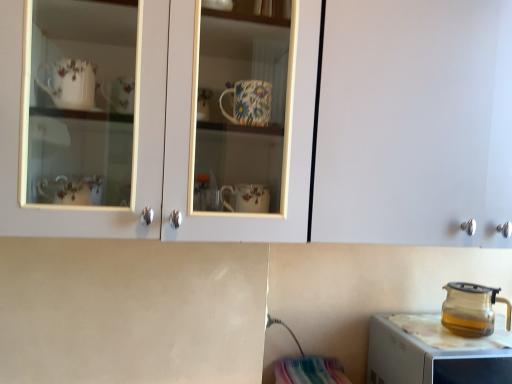
Image resolution: width=512 pixels, height=384 pixels. What do you see at coordinates (415, 122) in the screenshot? I see `matte white cabinet at upper center` at bounding box center [415, 122].

What is the approximate height of transparent glass kettle at lower right?

transparent glass kettle at lower right is 25.45 centimeters in height.

Locate an element on the screen. This screenshot has height=384, width=512. transparent glass kettle at lower right is located at coordinates (430, 354).

What are the coordinates of `matte white cabinet at upper center` in the screenshot? It's located at (415, 122).

Is matte white cabinet at upper center facing towards transparent glass teapot at right?

No, matte white cabinet at upper center is not facing towards transparent glass teapot at right.

Considering the relative sizes of matte white cabinet at upper center and transparent glass teapot at right in the image provided, is matte white cabinet at upper center taller than transparent glass teapot at right?

Indeed, matte white cabinet at upper center has a greater height compared to transparent glass teapot at right.

Is matte white cabinet at upper center beside transparent glass teapot at right?

No, matte white cabinet at upper center is not with transparent glass teapot at right.

Between point (396, 88) and point (415, 327), which one is positioned in front?

The point (396, 88) is closer to the camera.

Could transparent glass kettle at lower right be considered to be inside matte white cabinet at upper center?

No, transparent glass kettle at lower right is not a part of matte white cabinet at upper center.

Is matte white cabinet at upper center facing towards transparent glass kettle at lower right?

No, matte white cabinet at upper center is not turned towards transparent glass kettle at lower right.

Locate an element on the screen. The width and height of the screenshot is (512, 384). home appliance in front of the transparent glass teapot at right is located at coordinates (430, 354).

Would you say transparent glass kettle at lower right is part of transparent glass teapot at right's contents?

That's incorrect, transparent glass kettle at lower right is not inside transparent glass teapot at right.

Is point (493, 300) farther from viewer compared to point (448, 346)?

Yes.

Considering the sizes of transparent glass teapot at right and transparent glass kettle at lower right in the image, is transparent glass teapot at right taller or shorter than transparent glass kettle at lower right?

Clearly, transparent glass teapot at right is shorter compared to transparent glass kettle at lower right.

The image size is (512, 384). In order to click on cabinetry located on the left of transparent glass teapot at right in this screenshot , I will do `click(415, 122)`.

Can matte white cabinet at upper center be found inside transparent glass teapot at right?

Actually, matte white cabinet at upper center is outside transparent glass teapot at right.

From a real-world perspective, is transparent glass teapot at right above or below matte white cabinet at upper center?

From a real-world perspective, transparent glass teapot at right is physically below matte white cabinet at upper center.

Which is more distant, (475,306) or (445,122)?

Positioned behind is point (475,306).

Are transparent glass kettle at lower right and matte white cabinet at upper center located far from each other?

That's not correct — transparent glass kettle at lower right is a little close to matte white cabinet at upper center.

How many degrees apart are the facing directions of transparent glass kettle at lower right and matte white cabinet at upper center?

They differ by 2 degrees in their facing directions.

Does transparent glass kettle at lower right turn towards matte white cabinet at upper center?

No, transparent glass kettle at lower right is not oriented towards matte white cabinet at upper center.

From a real-world perspective, is transparent glass kettle at lower right on top of matte white cabinet at upper center?

Actually, transparent glass kettle at lower right is physically below matte white cabinet at upper center in the real world.

Where is `kitchen appliance above the transparent glass kettle at lower right (from the image's perspective)`? Image resolution: width=512 pixels, height=384 pixels. kitchen appliance above the transparent glass kettle at lower right (from the image's perspective) is located at coordinates (471, 309).

From a real-world perspective, which is physically below, transparent glass kettle at lower right or transparent glass teapot at right?

From a 3D spatial view, transparent glass kettle at lower right is below.

Can you confirm if transparent glass kettle at lower right is smaller than transparent glass teapot at right?

No, transparent glass kettle at lower right is not smaller than transparent glass teapot at right.

Does transparent glass kettle at lower right turn towards transparent glass teapot at right?

No, transparent glass kettle at lower right is not oriented towards transparent glass teapot at right.

You are a GUI agent. You are given a task and a screenshot of the screen. Output one action in this format:
    pyautogui.click(x=<x>, y=<y>)
    Task: Click on the kitchen appliance that appears on the right of matte white cabinet at upper center
    The height and width of the screenshot is (384, 512).
    Given the screenshot: What is the action you would take?
    click(471, 309)

In the image, there is a matte white cabinet at upper center. Identify the location of home appliance below it (from the image's perspective). The height and width of the screenshot is (384, 512). (430, 354).

Which object lies nearer to the anchor point transparent glass kettle at lower right, matte white cabinet at upper center or transparent glass teapot at right?

transparent glass teapot at right.

Estimate the real-world distances between objects in this image. Which object is further from transparent glass kettle at lower right, transparent glass teapot at right or matte white cabinet at upper center?

The object further to transparent glass kettle at lower right is matte white cabinet at upper center.

Based on their spatial positions, is transparent glass kettle at lower right or transparent glass teapot at right further from matte white cabinet at upper center?

Based on the image, transparent glass teapot at right appears to be further to matte white cabinet at upper center.

Looking at the image, which one is located closer to matte white cabinet at upper center, transparent glass teapot at right or transparent glass kettle at lower right?

Among the two, transparent glass kettle at lower right is located nearer to matte white cabinet at upper center.

Estimate the real-world distances between objects in this image. Which object is further from transparent glass teapot at right, matte white cabinet at upper center or transparent glass kettle at lower right?

matte white cabinet at upper center is further to transparent glass teapot at right.

Estimate the real-world distances between objects in this image. Which object is closer to transparent glass teapot at right, transparent glass kettle at lower right or matte white cabinet at upper center?

transparent glass kettle at lower right lies closer to transparent glass teapot at right than the other object.

Identify the location of kitchen appliance between matte white cabinet at upper center and transparent glass kettle at lower right in the vertical direction. (471, 309).